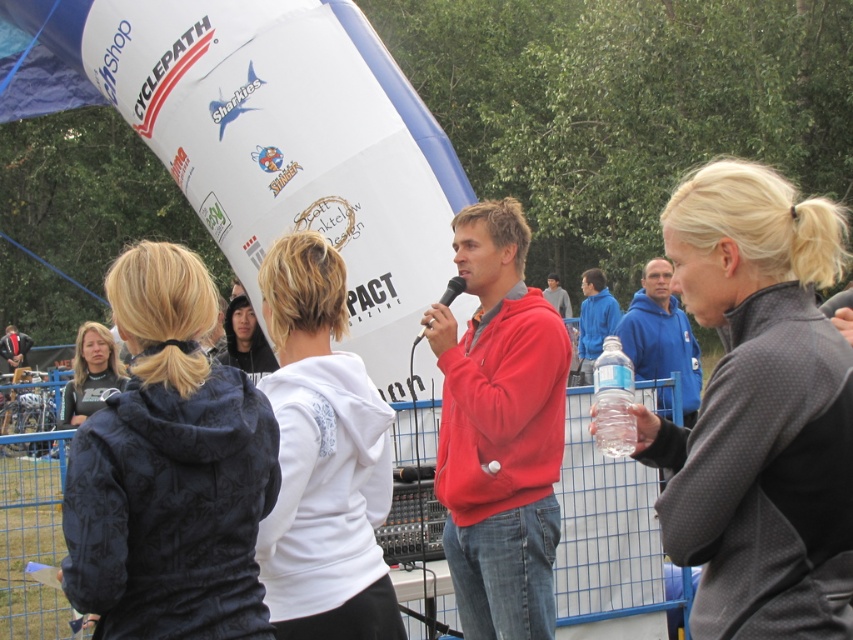
Question: Where is dark gray fleece jacket at right located in relation to matte black jacket at lower left in the image?

Choices:
 (A) below
 (B) above

Answer: (B)

Question: Which object is positioned closest to the dark gray fleece jacket at right?

Choices:
 (A) white fleece jacket at center
 (B) dark blue quilted jacket at center

Answer: (A)

Question: Among these points, which one is nearest to the camera?

Choices:
 (A) (599, 364)
 (B) (804, 436)
 (C) (273, 618)

Answer: (B)

Question: Which of the following is the farthest from the observer?

Choices:
 (A) clear plastic bottle at lower right
 (B) matte black jacket at lower left

Answer: (B)

Question: Does white fleece jacket at center appear on the right side of matte black jacket at lower left?

Choices:
 (A) no
 (B) yes

Answer: (B)

Question: Observing the image, what is the correct spatial positioning of dark gray fleece jacket at right in reference to dark blue quilted jacket at center?

Choices:
 (A) below
 (B) above

Answer: (B)